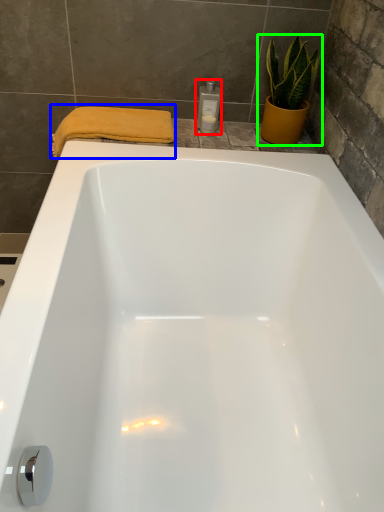
Question: Estimate the real-world distances between objects in this image. Which object is farther from toiletry (highlighted by a red box), bath towel (highlighted by a blue box) or houseplant (highlighted by a green box)?

Choices:
 (A) bath towel
 (B) houseplant

Answer: (A)